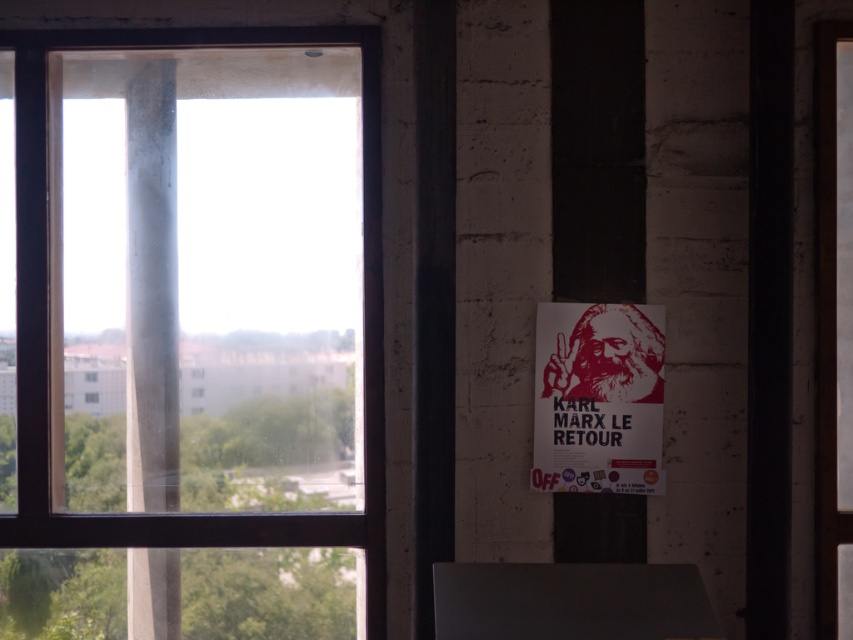
Question: Which of the following is the closest to the observer?

Choices:
 (A) (144, 316)
 (B) (648, 371)
 (C) (56, 390)

Answer: (B)

Question: Is the position of transparent glass window at left more distant than that of gray concrete pillar at center?

Choices:
 (A) no
 (B) yes

Answer: (A)

Question: Based on their relative distances, which object is farther from the gray concrete pillar at center?

Choices:
 (A) transparent glass window at left
 (B) red matte poster at right

Answer: (B)

Question: Does transparent glass window at left appear under red matte poster at right?

Choices:
 (A) yes
 (B) no

Answer: (B)

Question: Does gray concrete pillar at center appear over red matte poster at right?

Choices:
 (A) no
 (B) yes

Answer: (B)

Question: Considering the real-world distances, which object is closest to the red matte poster at right?

Choices:
 (A) gray concrete pillar at center
 (B) transparent glass window at left

Answer: (B)